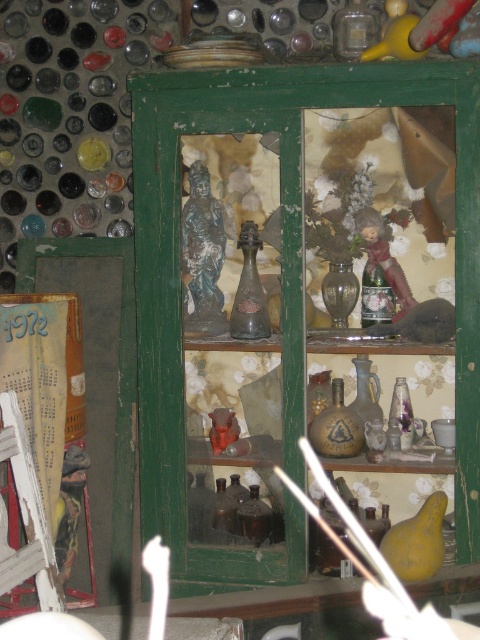
Question: Is matte brown bottle at center thinner than matte porcelain doll at center?

Choices:
 (A) yes
 (B) no

Answer: (A)

Question: Which of the following is the closest to the observer?

Choices:
 (A) (349, 8)
 (B) (406, 308)
 (C) (242, 308)
 (D) (284, 365)

Answer: (D)

Question: Is green matte cabinet at center positioned behind matte porcelain doll at center?

Choices:
 (A) yes
 (B) no

Answer: (B)

Question: Which point is closer to the camera?

Choices:
 (A) matte glass bottle at upper center
 (B) matte porcelain doll at center

Answer: (A)

Question: Which point is farther from the camera taking this photo?

Choices:
 (A) (395, 292)
 (B) (339, 42)
 (C) (460, 246)
 (D) (243, 316)

Answer: (A)

Question: Is green matte cabinet at center below matte porcelain doll at center?

Choices:
 (A) yes
 (B) no

Answer: (A)